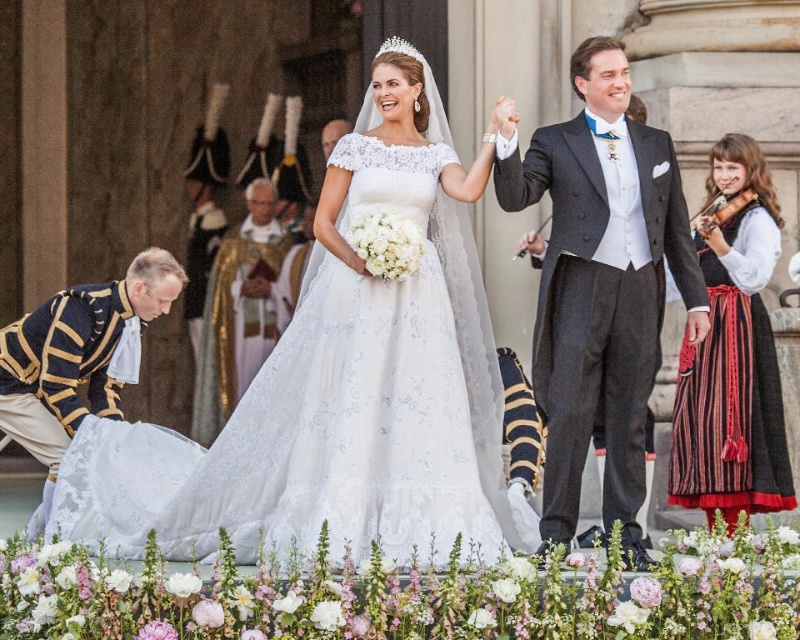
You are a photographer at a royal wedding. You need to decide which outfit to adjust first to ensure they fit in the frame. The outfits are the matte black suit at upper right and the striped cotton dress at right. Which outfit requires more space due to its width?

The matte black suit at upper right requires more space because its width is larger than the striped cotton dress at right.

You are a photographer positioned at the center of the scene. You need to take a photo of the matte black suit at upper right. Based on its coordinates, in which direction should you move your camera to capture it in the frame?

The matte black suit at upper right is located at coordinates point (x=600, y=282). Since the photographer is at the center, moving the camera to the right and upward will position the matte black suit at upper right within the frame.

In the wedding scene described, there are two dresses present. The lace fabric wedding dress at center and the striped cotton dress at right. Which dress is taller?

The lace fabric wedding dress at center is much taller than the striped cotton dress at right.